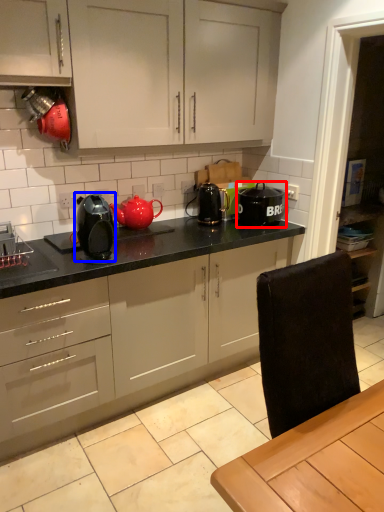
Question: Which object is further to the camera taking this photo, kitchen appliance (highlighted by a red box) or home appliance (highlighted by a blue box)?

Choices:
 (A) kitchen appliance
 (B) home appliance

Answer: (A)